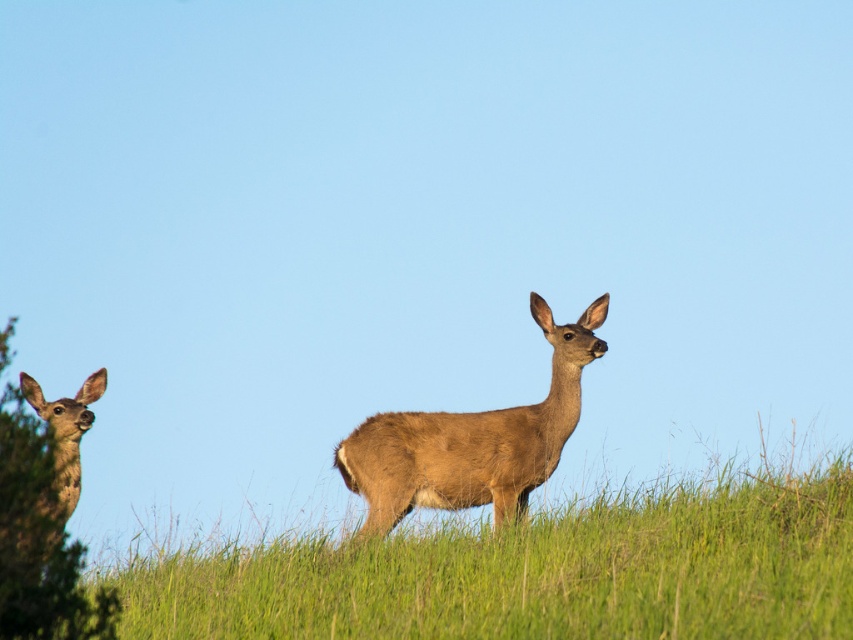
You are a photographer setting up a shot of the green grass at center and the brown fuzzy deer at left. Which object occupies more horizontal space in the image?

The green grass at center occupies more horizontal space than the brown fuzzy deer at left because its width is larger.

You are standing in the grassy field and see two points marked in the scene. Which point is closer to you, point (532, 566) or point (73, 468)?

Point (532, 566) is in front of point (73, 468), so it is closer to you.